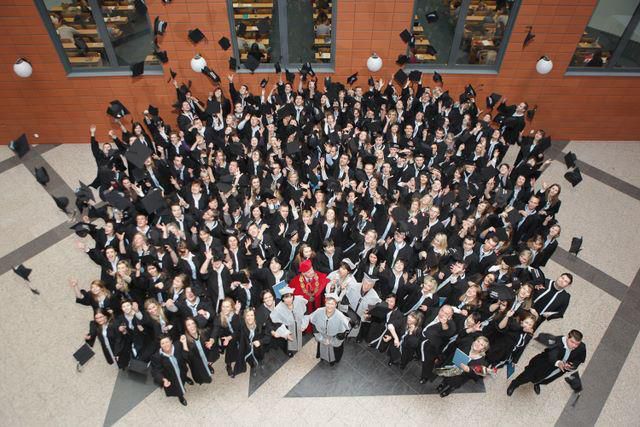
Locate an element on the screen. This screenshot has width=640, height=427. light is located at coordinates (22, 71), (198, 64), (372, 63), (546, 69).